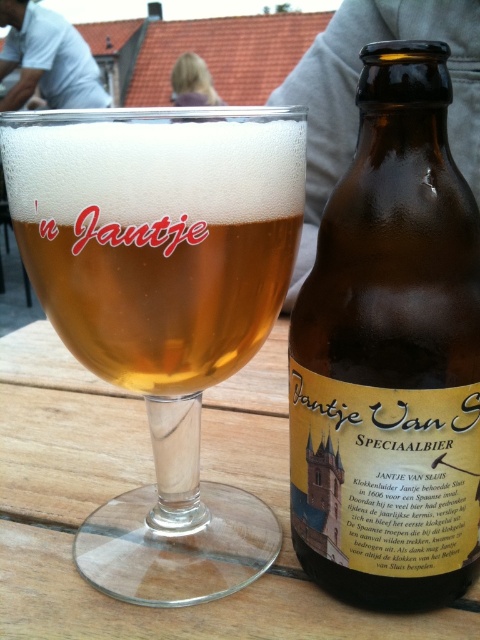
You are setting up a table for a party and want to ensure there is enough space between the clear glass beer glass at center and the brown glass bottle at center. If the bottle is 7 cm in diameter, what is the minimum width of the table needed to place both items side by side without touching?

The clear glass beer glass at center might be wider than brown glass bottle at center. Since the bottle is 7 cm in diameter, the table must be at least 14 cm wide to accommodate both items side by side without touching.

You are standing at the point with coordinates point (471,374) and want to walk to the point with coordinates point (153,538). According to the spatial arrangement, will the glass of beer or the bottle of beer block your path?

Point (153,538) is behind point (471,374), so the path to point (153,538) is not blocked by any object since it is located behind the starting point.